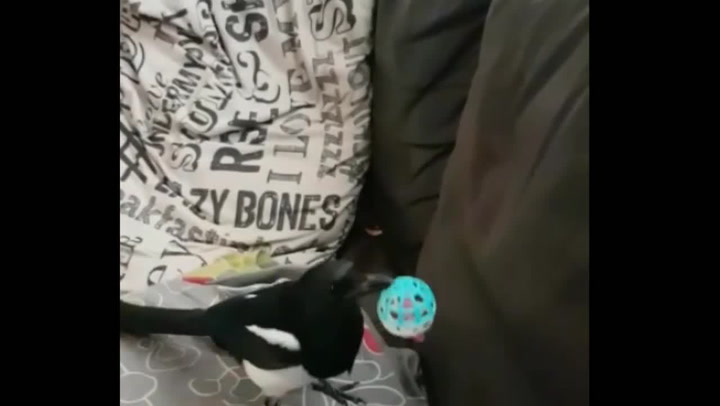
This screenshot has height=406, width=720. In order to click on black bird on a couch in this screenshot , I will do `click(315, 311)`.